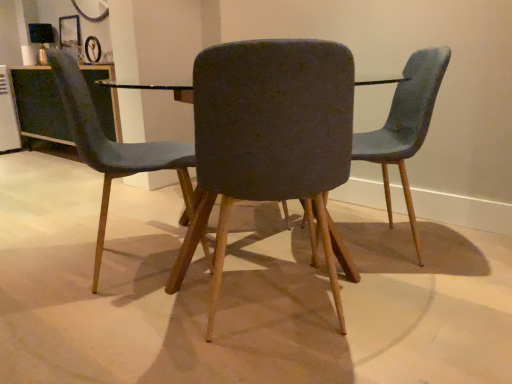
I want to click on free space between matte black table at center and velvet blue chair at left, which appears as the third chair when viewed from the right, so click(x=152, y=287).